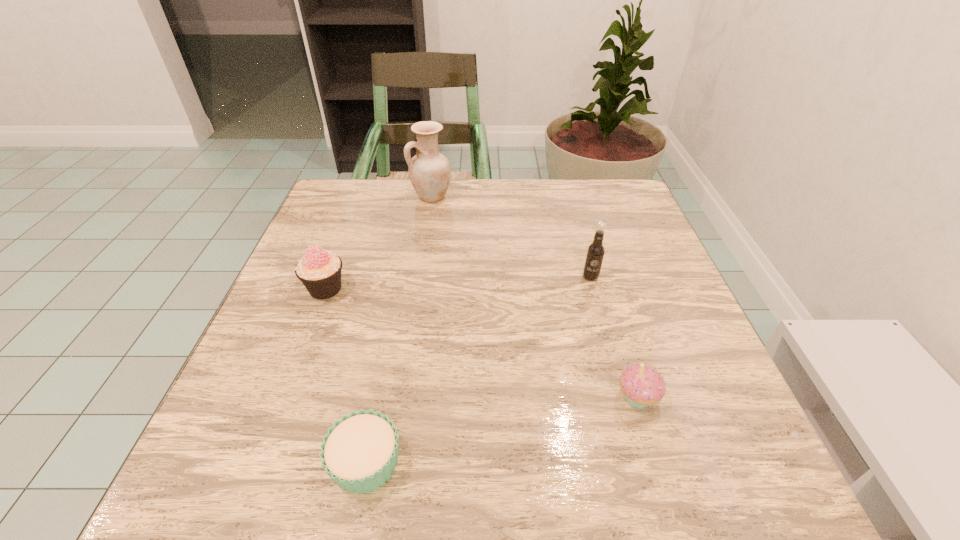
Image resolution: width=960 pixels, height=540 pixels. Identify the location of vacant point that satisfies the following two spatial constraints: 1. on the label of the second farthest cupcake; 2. on the right side of the fourth shortest object. (624, 397).

Identify the location of vacant area in the image that satisfies the following two spatial constraints: 1. on the front side of the fourth farthest object; 2. on the left side of the pottery. (400, 397).

This screenshot has width=960, height=540. I want to click on vacant space that satisfies the following two spatial constraints: 1. on the label of the fourth shortest object; 2. on the left side of the second nearest object, so click(624, 397).